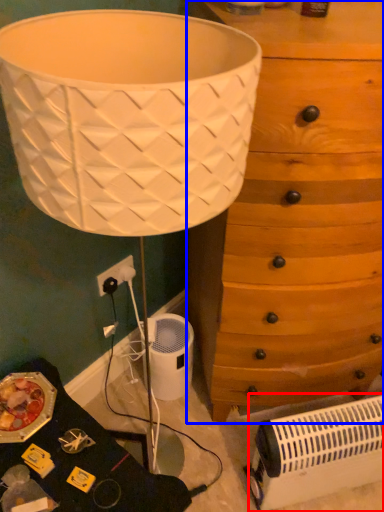
Question: Which object is closer to the camera taking this photo, heater (highlighted by a red box) or chest of drawers (highlighted by a blue box)?

Choices:
 (A) heater
 (B) chest of drawers

Answer: (B)